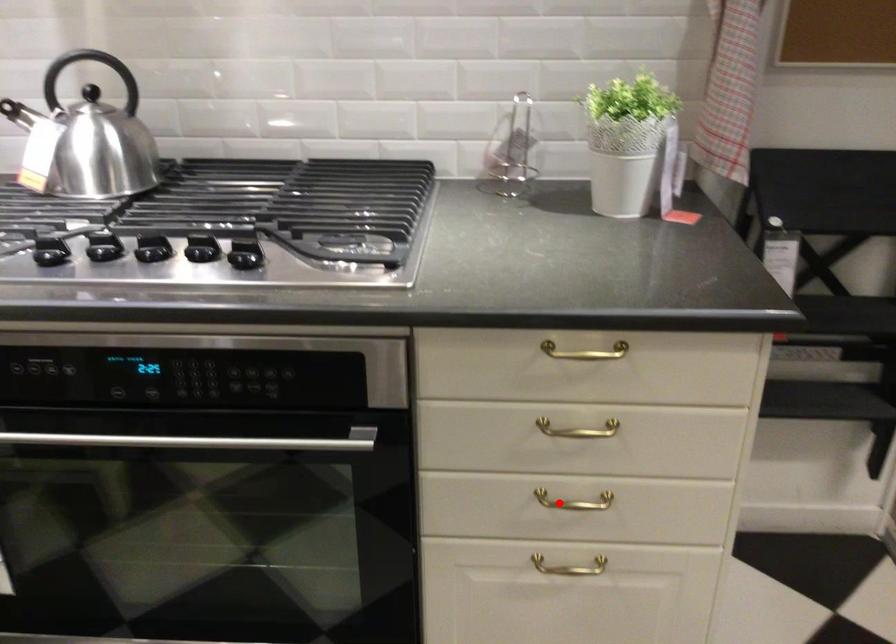
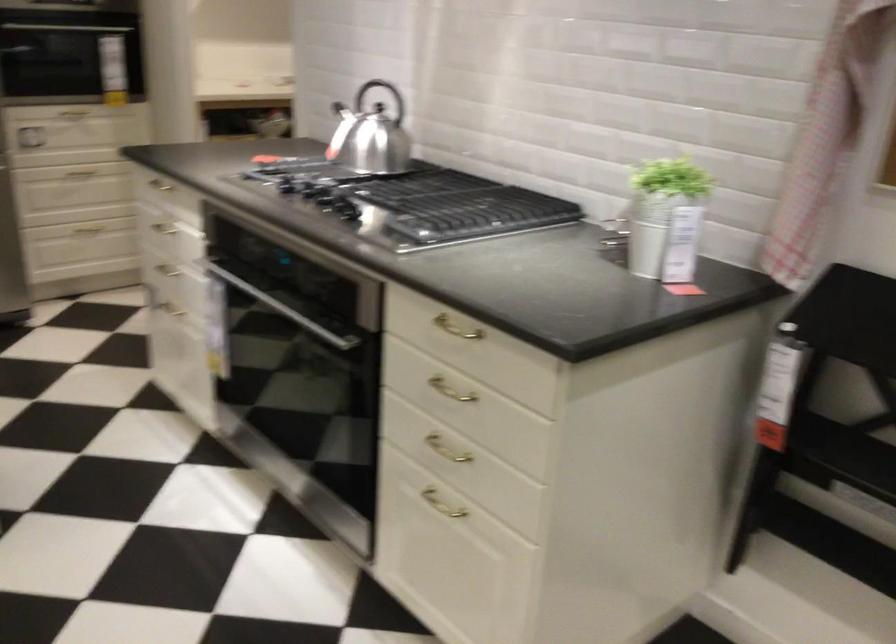
Find the pixel in the second image that matches the highlighted location in the first image.

(446, 448)